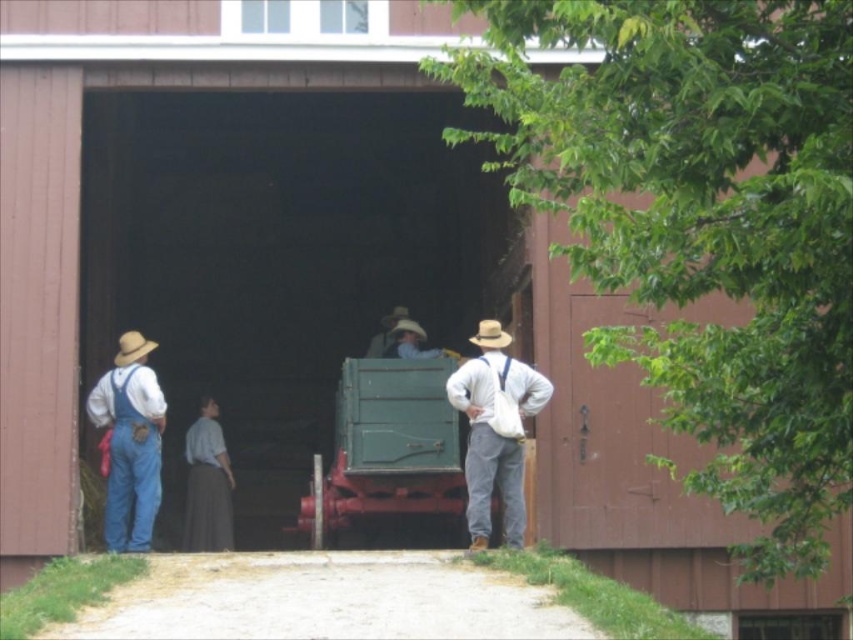
You are an observer standing in front of the barn. You notice two hats at the center of the image. Which hat is positioned lower between the light brown leather hat at center and the brown felt cowboy hat at center?

The light brown leather hat at center is located below the brown felt cowboy hat at center, so the light brown leather hat at center is positioned lower.

You are a tailor observing the two hats at the center of the image. Which hat would require more fabric to construct, the light brown fabric hat at center or the light brown leather hat at center?

The light brown fabric hat at center would require more fabric to construct because it is much taller than the light brown leather hat at center, and taller hats generally need more material.

You are a tailor measuring hats for a costume party. You have two hats in front of you, the light brown fabric hat at center and the light brown leather hat at center. Which hat has a larger width?

The light brown fabric hat at center has a larger width than the light brown leather hat at center.